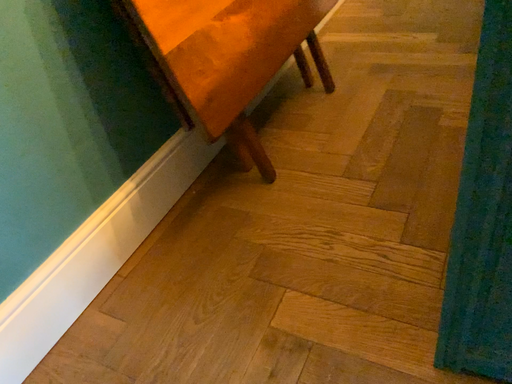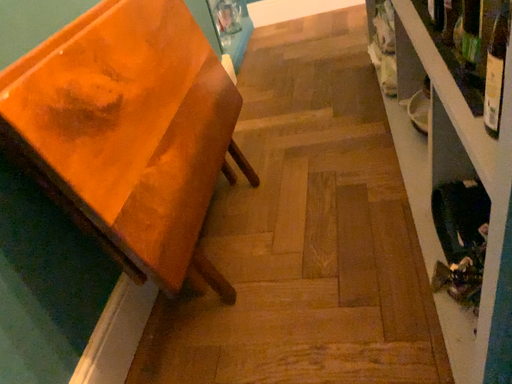
Question: Which way did the camera rotate in the video?

Choices:
 (A) rotated upward
 (B) rotated downward

Answer: (A)